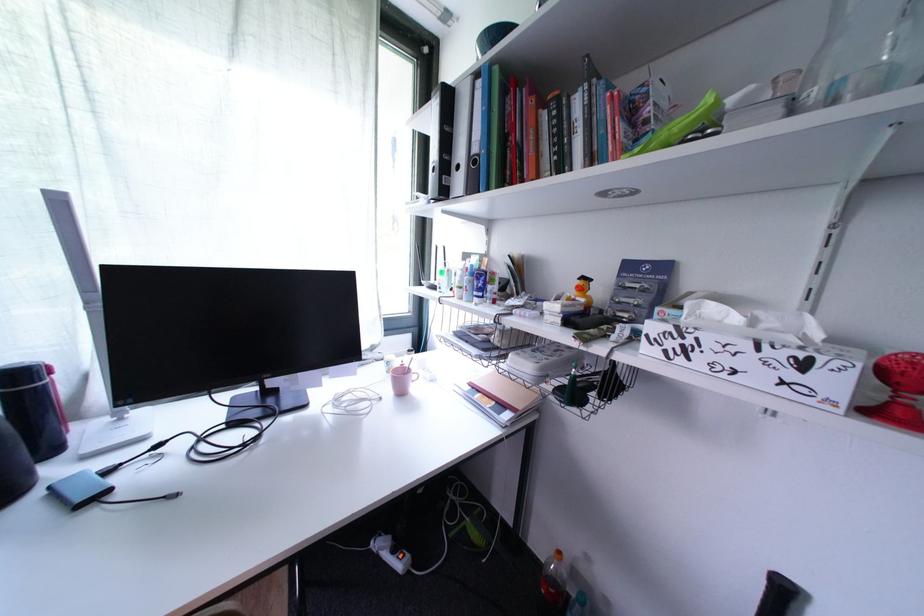
What do you see at coordinates (398, 552) in the screenshot? I see `the power strip switch` at bounding box center [398, 552].